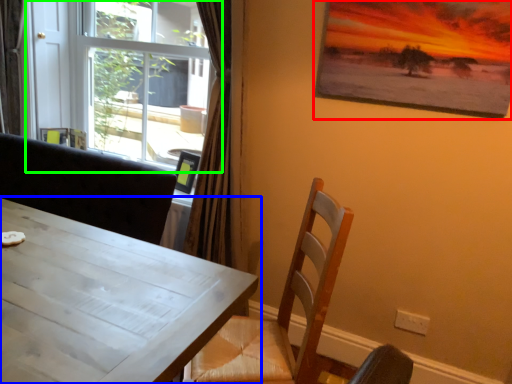
Question: Estimate the real-world distances between objects in this image. Which object is farther from picture frame (highlighted by a red box), table (highlighted by a blue box) or window (highlighted by a green box)?

Choices:
 (A) table
 (B) window

Answer: (B)